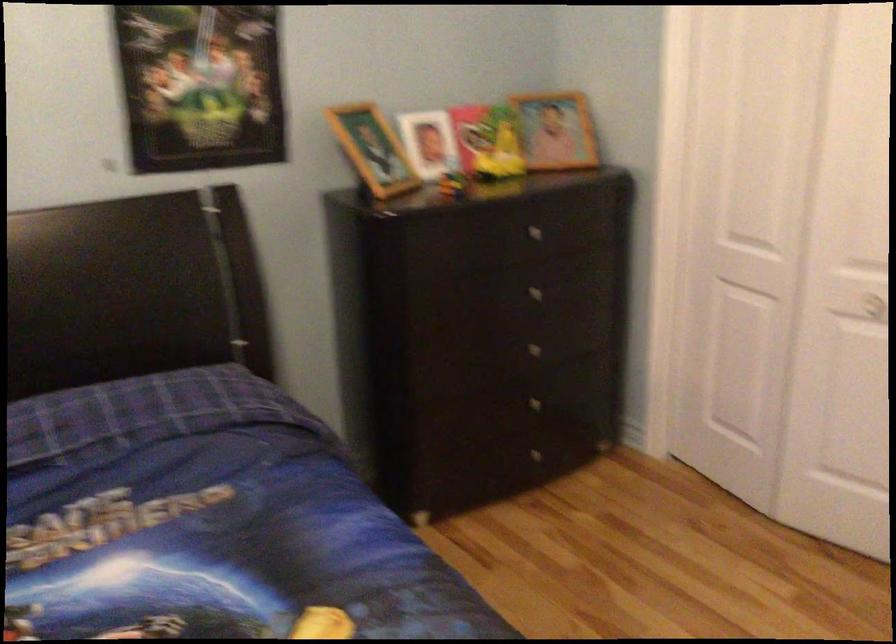
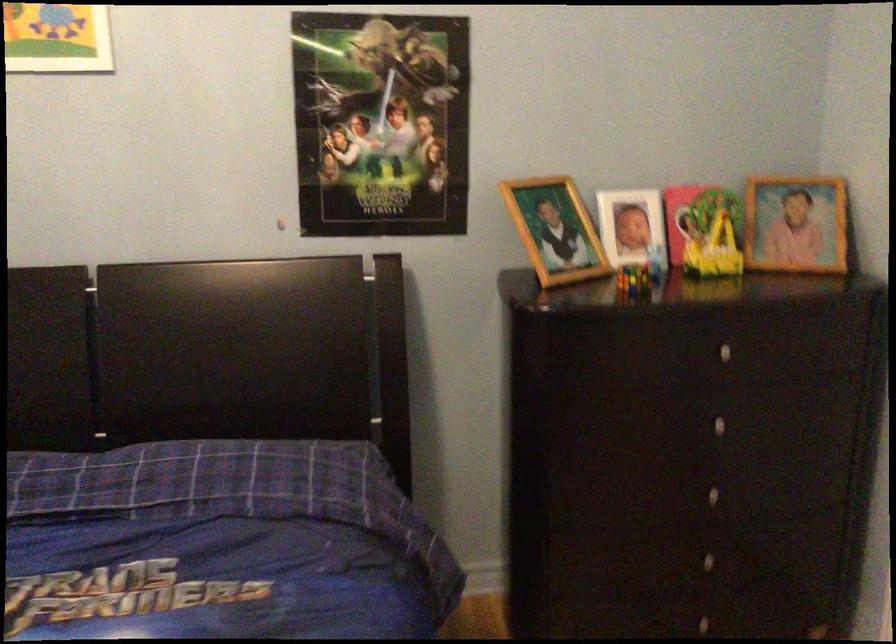
Where in the second image is the point corresponding to the point at 454,182 from the first image?

(634, 279)